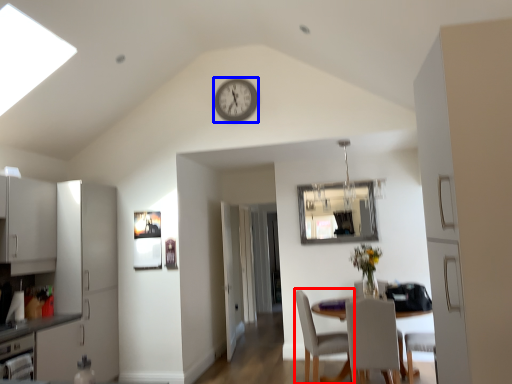
Question: Among these objects, which one is nearest to the camera, chair (highlighted by a red box) or clock (highlighted by a blue box)?

Choices:
 (A) chair
 (B) clock

Answer: (A)